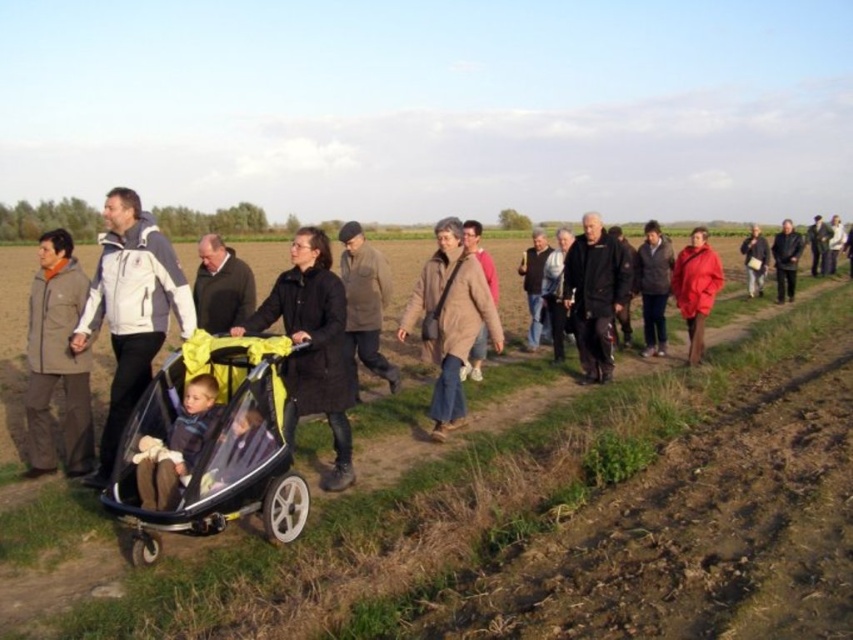
How much distance is there between white fleece jacket at left and matte brown jacket at left?

white fleece jacket at left and matte brown jacket at left are 27.39 inches apart.

Who is positioned more to the right, white fleece jacket at left or matte brown jacket at left?

white fleece jacket at left is more to the right.

Between point (68, 348) and point (68, 381), which one is positioned in front?

Point (68, 348)

Identify the location of white fleece jacket at left. The width and height of the screenshot is (853, 640). (131, 308).

Does transparent plastic baby carriage at center appear on the left side of black matte jacket at center?

Correct, you'll find transparent plastic baby carriage at center to the left of black matte jacket at center.

Does transparent plastic baby carriage at center have a lesser height compared to black matte jacket at center?

Indeed, transparent plastic baby carriage at center has a lesser height compared to black matte jacket at center.

Is point (195, 364) more distant than point (579, 324)?

No, it is not.

Locate an element on the screen. transparent plastic baby carriage at center is located at coordinates (210, 445).

Who is more forward, (77, 305) or (386, 369)?

Point (77, 305) is in front.

Which is more to the right, matte brown jacket at left or brown woolen coat at center?

brown woolen coat at center

Is point (55, 301) farther from viewer compared to point (347, 282)?

No, it is not.

I want to click on matte brown jacket at left, so click(57, 358).